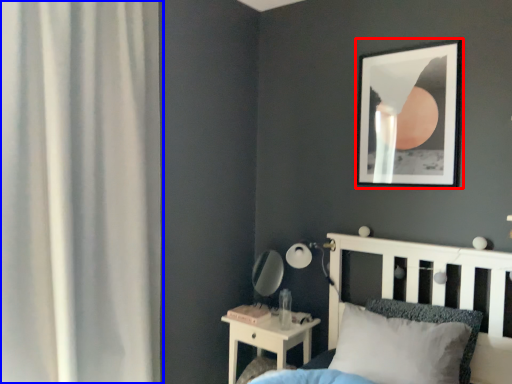
Question: Which object appears farthest to the camera in this image, picture frame (highlighted by a red box) or curtain (highlighted by a blue box)?

Choices:
 (A) picture frame
 (B) curtain

Answer: (A)